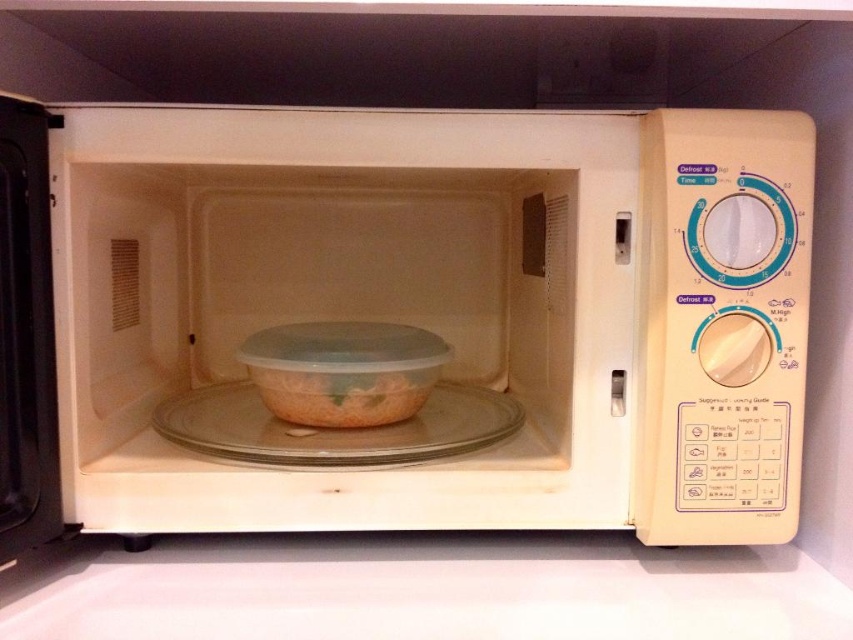
Is clear glass plate at center taller than translucent plastic bowl at center?

Incorrect, clear glass plate at center's height is not larger of translucent plastic bowl at center's.

Who is positioned more to the right, clear glass plate at center or translucent plastic bowl at center?

From the viewer's perspective, translucent plastic bowl at center appears more on the right side.

Identify the location of clear glass plate at center. Image resolution: width=853 pixels, height=640 pixels. (335, 428).

Who is more forward, [335,189] or [630,547]?

Point [630,547] is in front.

In the scene shown: Is the position of white plastic microwave at center less distant than that of white matte counter top at lower center?

No.

Find the location of `white plastic microwave at center`. white plastic microwave at center is located at coordinates (434, 316).

Where is `white plastic microwave at center`? Image resolution: width=853 pixels, height=640 pixels. white plastic microwave at center is located at coordinates (434, 316).

How distant is white plastic microwave at center from clear glass plate at center?

They are 8.63 centimeters apart.

Is white plastic microwave at center wider than clear glass plate at center?

Indeed, white plastic microwave at center has a greater width compared to clear glass plate at center.

Is point (308, 184) more distant than point (410, 429)?

Yes, it is.

The width and height of the screenshot is (853, 640). I want to click on white plastic microwave at center, so click(x=434, y=316).